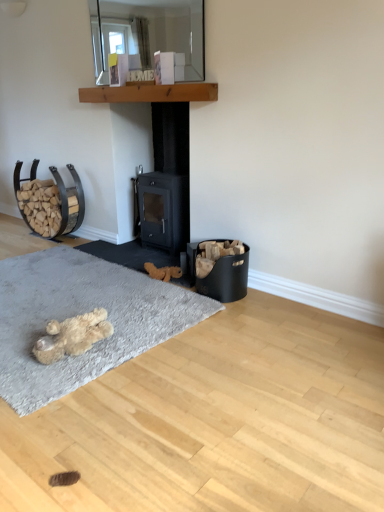
Question: Is brown plush toy at center, arranged as the second animal when viewed from the front, at the right side of black matte fireplace at center?

Choices:
 (A) no
 (B) yes

Answer: (A)

Question: Can you confirm if brown plush toy at center, arranged as the second animal when viewed from the front, is bigger than black matte fireplace at center?

Choices:
 (A) yes
 (B) no

Answer: (B)

Question: Considering the relative sizes of brown plush toy at center, the second animal from the bottom, and black matte fireplace at center in the image provided, is brown plush toy at center, the second animal from the bottom, wider than black matte fireplace at center?

Choices:
 (A) no
 (B) yes

Answer: (A)

Question: Is brown plush toy at center, which is the 1th animal in back-to-front order, positioned with its back to black matte fireplace at center?

Choices:
 (A) no
 (B) yes

Answer: (A)

Question: Are brown plush toy at center, arranged as the second animal when viewed from the front, and black matte fireplace at center located far from each other?

Choices:
 (A) yes
 (B) no

Answer: (B)

Question: From a real-world perspective, is clear glass mirror at upper center above or below black matte fireplace at center?

Choices:
 (A) above
 (B) below

Answer: (A)

Question: Is clear glass mirror at upper center taller or shorter than black matte fireplace at center?

Choices:
 (A) tall
 (B) short

Answer: (B)

Question: Looking at their shapes, would you say clear glass mirror at upper center is wider or thinner than black matte fireplace at center?

Choices:
 (A) wide
 (B) thin

Answer: (B)

Question: Would you say clear glass mirror at upper center is to the left or to the right of black matte fireplace at center in the picture?

Choices:
 (A) left
 (B) right

Answer: (A)

Question: From the image's perspective, relative to clear glass mirror at upper center, is fuzzy beige teddy bear at lower left, which appears as the second animal when viewed from the back, above or below?

Choices:
 (A) below
 (B) above

Answer: (A)

Question: Considering the positions of fuzzy beige teddy bear at lower left, the 1th animal positioned from the left, and clear glass mirror at upper center in the image, is fuzzy beige teddy bear at lower left, the 1th animal positioned from the left, wider or thinner than clear glass mirror at upper center?

Choices:
 (A) wide
 (B) thin

Answer: (A)

Question: Considering the positions of fuzzy beige teddy bear at lower left, which is the first animal from front to back, and clear glass mirror at upper center in the image, is fuzzy beige teddy bear at lower left, which is the first animal from front to back, bigger or smaller than clear glass mirror at upper center?

Choices:
 (A) small
 (B) big

Answer: (A)

Question: From a real-world perspective, is fuzzy beige teddy bear at lower left, the 1th animal positioned from the left, physically located above or below clear glass mirror at upper center?

Choices:
 (A) below
 (B) above

Answer: (A)

Question: Considering the positions of black matte fireplace at center and clear glass mirror at upper center in the image, is black matte fireplace at center wider or thinner than clear glass mirror at upper center?

Choices:
 (A) thin
 (B) wide

Answer: (B)

Question: From a real-world perspective, is black matte fireplace at center above or below clear glass mirror at upper center?

Choices:
 (A) above
 (B) below

Answer: (B)